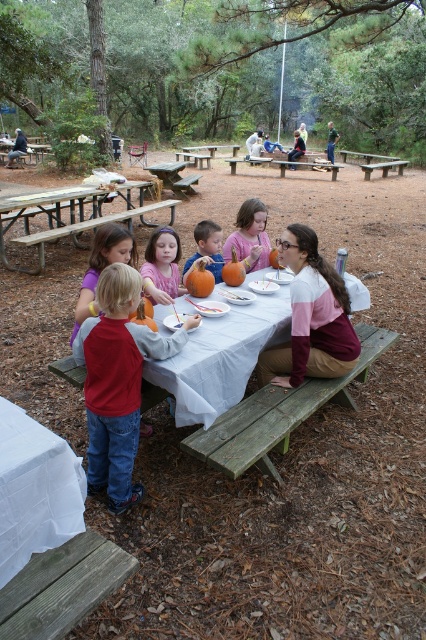
Does white cloth table at lower left have a greater height compared to pink matte pumpkin at center?

In fact, white cloth table at lower left may be shorter than pink matte pumpkin at center.

I want to click on white cloth table at lower left, so click(34, 490).

You are a GUI agent. You are given a task and a screenshot of the screen. Output one action in this format:
    pyautogui.click(x=<x>, y=<y>)
    Task: Click on the white cloth table at lower left
    This screenshot has width=426, height=640.
    Given the screenshot: What is the action you would take?
    [34, 490]

Does white cloth table at lower left have a greater height compared to orange matte pumpkin at center?

Indeed, white cloth table at lower left has a greater height compared to orange matte pumpkin at center.

Between point (77, 492) and point (198, 305), which one is positioned behind?

The point (198, 305) is more distant.

The image size is (426, 640). In order to click on white cloth table at lower left in this screenshot , I will do `click(34, 490)`.

At what (x,y) coordinates should I click in order to perform the action: click on white cloth table at lower left. Please return your answer as a coordinate pair (x, y). Looking at the image, I should click on (34, 490).

Who is positioned more to the right, matte pink shirt at center or matte orange pumpkin at center?

matte orange pumpkin at center is more to the right.

Identify the location of matte pink shirt at center. This screenshot has width=426, height=640. (161, 266).